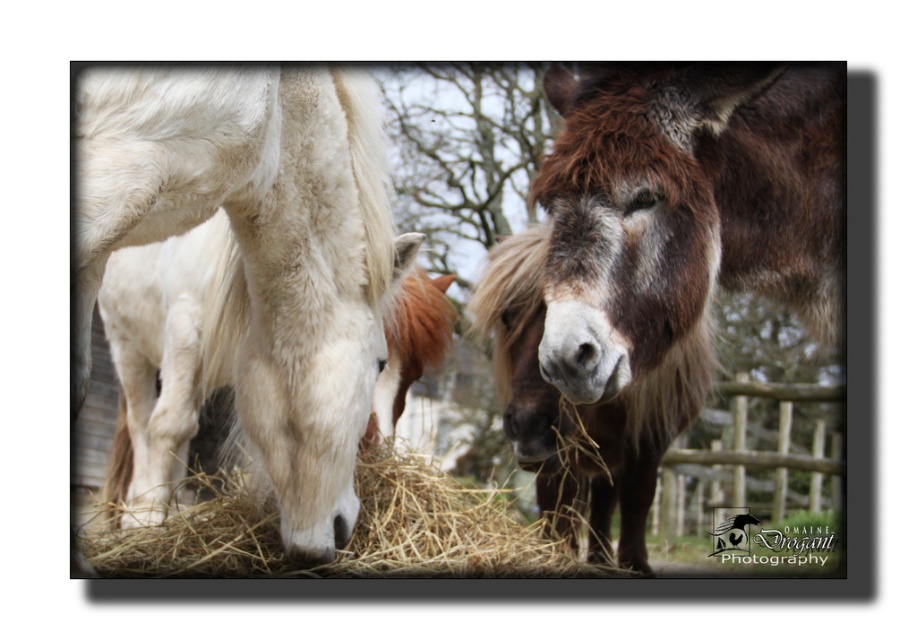
Based on the scene description, where is the brown fuzzy mule at center located in terms of coordinates?

The brown fuzzy mule at center is located at coordinates point (656, 262).

You are standing in the pasture and want to approach the white fluffy horse at left. Based on its position, which direction should you move from your current spot to reach it?

The white fluffy horse at left is located at point 0.397 on the x and 0.284 on the y coordinate. To reach it, you should move towards the lower left direction since the coordinates suggest it is positioned towards the lower left area of the image.